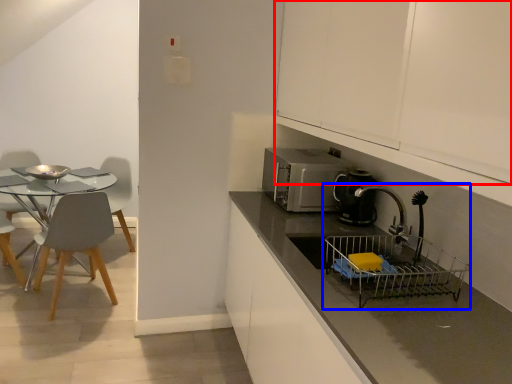
Question: Which point is closer to the camera, cabinetry (highlighted by a red box) or sink (highlighted by a blue box)?

Choices:
 (A) cabinetry
 (B) sink

Answer: (A)